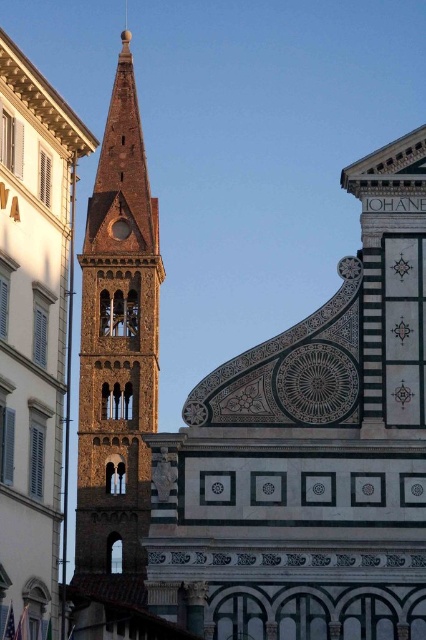
Does brown stone tower at center appear on the left side of brown textured tower at center?

No, brown stone tower at center is not to the left of brown textured tower at center.

Between brown stone tower at center and brown textured tower at center, which one has more height?

With more height is brown textured tower at center.

Is point (40, 326) less distant than point (132, 544)?

Yes, point (40, 326) is closer to viewer.

I want to click on brown stone tower at center, so click(34, 333).